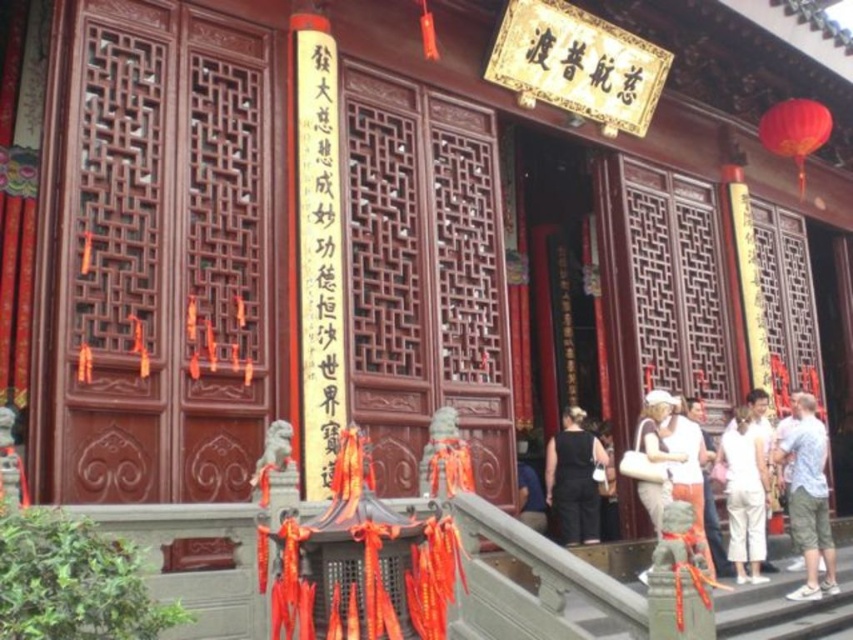
Question: Can you confirm if light blue denim shorts at right is positioned above black fabric dress at lower center?

Choices:
 (A) yes
 (B) no

Answer: (B)

Question: Is light blue denim shorts at right to the right of black fabric dress at lower center from the viewer's perspective?

Choices:
 (A) no
 (B) yes

Answer: (B)

Question: Which of these objects is positioned farthest from the light blue denim shorts at right?

Choices:
 (A) white cotton pants at lower right
 (B) black fabric dress at lower center

Answer: (B)

Question: Estimate the real-world distances between objects in this image. Which object is farther from the white cotton pants at lower right?

Choices:
 (A) black fabric dress at lower center
 (B) light blue denim shorts at right

Answer: (A)

Question: Does black paper with gold ink at center have a greater width compared to white cotton pants at lower right?

Choices:
 (A) yes
 (B) no

Answer: (B)

Question: Which object is positioned farthest from the light blue denim shorts at right?

Choices:
 (A) black fabric dress at lower center
 (B) white cotton pants at lower right
 (C) black paper with gold ink at center

Answer: (C)